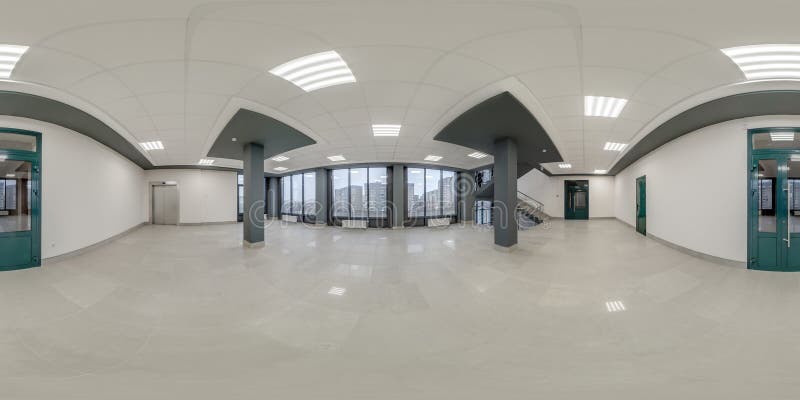
Locate an element on the screen. columns is located at coordinates (249, 177), (500, 167).